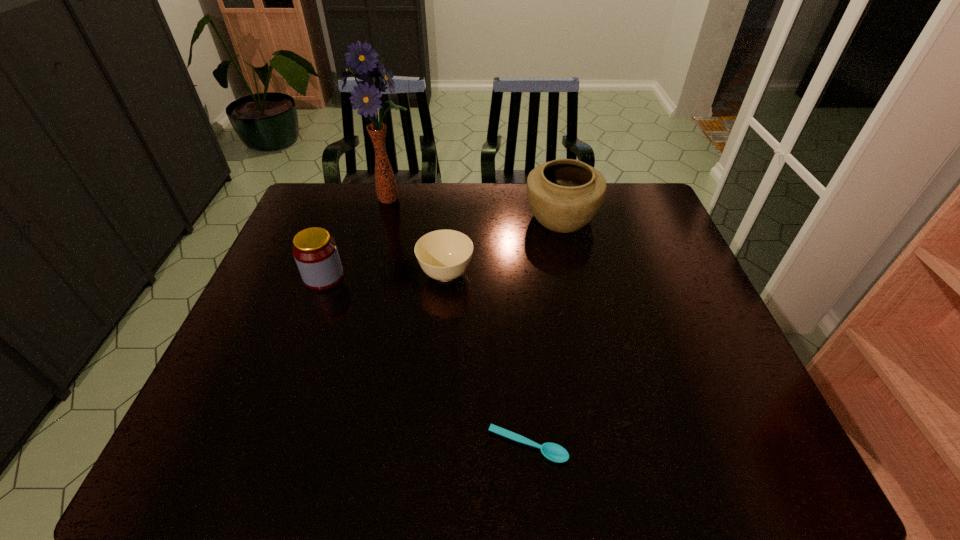
This screenshot has height=540, width=960. I want to click on flower arrangement, so click(x=365, y=97).

At what (x,y) coordinates should I click in order to perform the action: click on the second tallest object. Please return your answer as a coordinate pair (x, y). Image resolution: width=960 pixels, height=540 pixels. Looking at the image, I should click on (564, 195).

The height and width of the screenshot is (540, 960). Find the location of `jar`. jar is located at coordinates pos(315,251).

You are a GUI agent. You are given a task and a screenshot of the screen. Output one action in this format:
    pyautogui.click(x=<x>, y=<y>)
    Task: Click on the third object from right to left
    This screenshot has width=960, height=540.
    Given the screenshot: What is the action you would take?
    pyautogui.click(x=444, y=255)

The width and height of the screenshot is (960, 540). In order to click on sugar bowl in this screenshot , I will do `click(444, 255)`.

Find the location of a particular element. The width and height of the screenshot is (960, 540). spoon is located at coordinates (554, 452).

Where is `the shortest object`? Image resolution: width=960 pixels, height=540 pixels. the shortest object is located at coordinates (554, 452).

The height and width of the screenshot is (540, 960). Identify the location of free region located 0.200m on the front of the tallest object. (375, 253).

Locate an element on the screen. Image resolution: width=960 pixels, height=540 pixels. vacant space situated 0.140m on the right of the pottery is located at coordinates (641, 218).

This screenshot has height=540, width=960. Find the location of `vacant region located on the back of the jar`. vacant region located on the back of the jar is located at coordinates (341, 230).